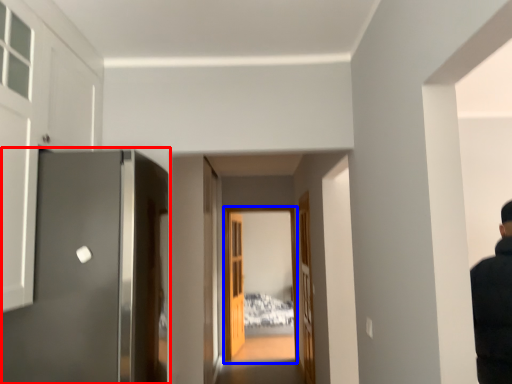
Question: Which object is further to the camera taking this photo, door (highlighted by a red box) or glass door (highlighted by a blue box)?

Choices:
 (A) door
 (B) glass door

Answer: (B)